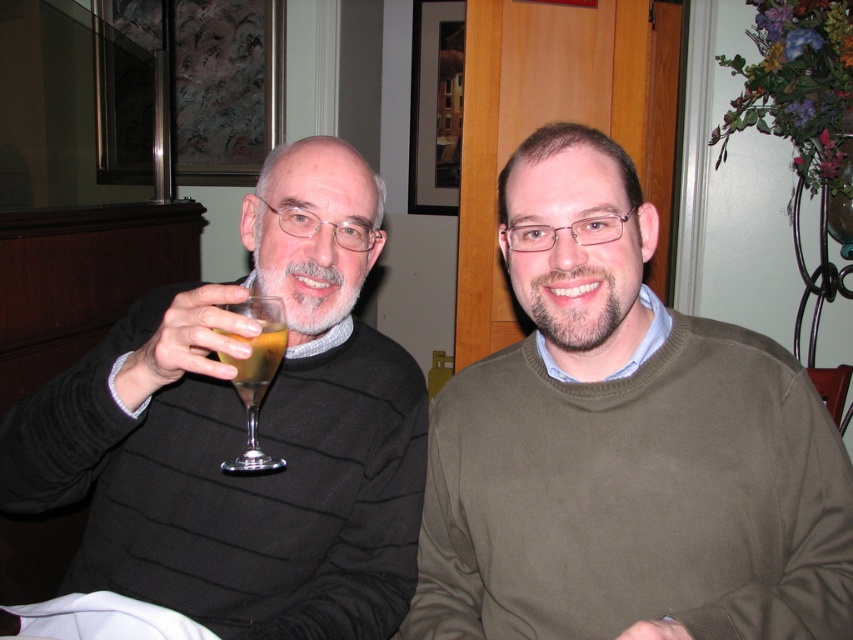
Question: Which point is closer to the camera?

Choices:
 (A) click(x=267, y=468)
 (B) click(x=51, y=420)

Answer: (A)

Question: Which object is closer to the camera taking this photo?

Choices:
 (A) clear glass wine glass at left
 (B) olive-green sweater at center
 (C) black sweater at left

Answer: (B)

Question: Is olive-green sweater at center positioned at the back of clear glass wine glass at left?

Choices:
 (A) no
 (B) yes

Answer: (A)

Question: Can you confirm if clear glass wine glass at left is positioned to the right of translucent glass at upper left?

Choices:
 (A) yes
 (B) no

Answer: (B)

Question: Is black sweater at left below translucent glass at upper left?

Choices:
 (A) no
 (B) yes

Answer: (B)

Question: Which point is closer to the camera taking this photo?

Choices:
 (A) (244, 307)
 (B) (281, 310)
 (C) (349, 497)

Answer: (B)